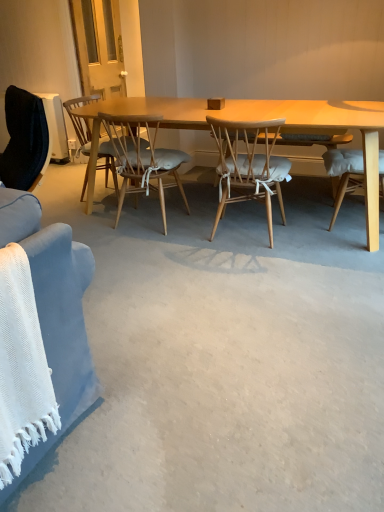
Locate an element on the screen. blank area beneath light brown woven wood chair at center, placed as the 3th chair when sorted from left to right (from a real-world perspective) is located at coordinates (247, 231).